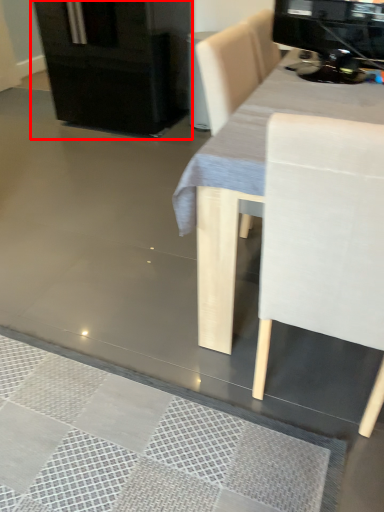
Question: Considering the relative positions of fridge (annotated by the red box) and appliance in the image provided, where is fridge (annotated by the red box) located with respect to the staircase?

Choices:
 (A) right
 (B) left

Answer: (B)